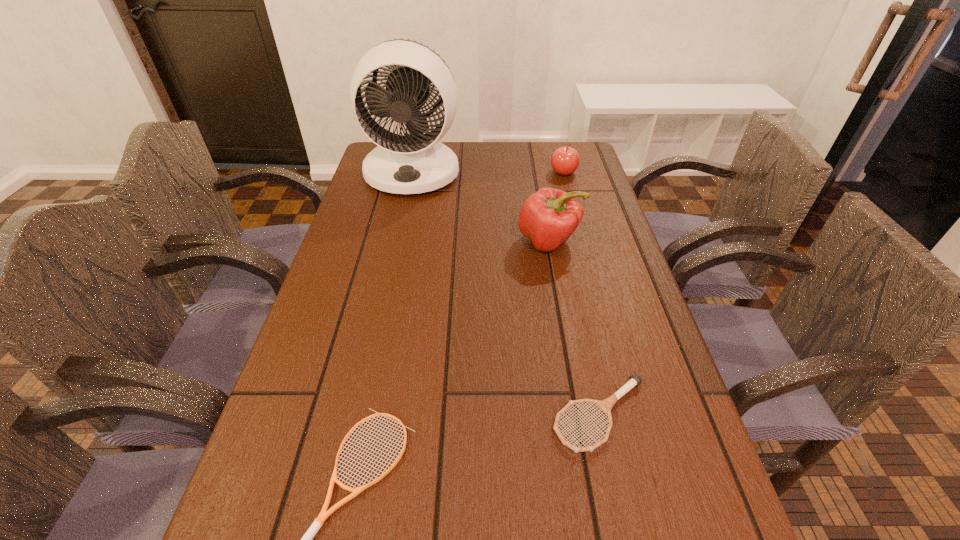
I want to click on fan, so click(414, 163).

In order to click on bell pepper in this screenshot , I will do `click(549, 217)`.

I want to click on the fourth shortest object, so click(549, 217).

Identify the location of the third shortest object. (565, 160).

Find the location of a particular element. This screenshot has width=960, height=540. the fourth tallest object is located at coordinates (605, 405).

The width and height of the screenshot is (960, 540). In order to click on the right tennis racket in this screenshot , I will do `click(605, 405)`.

Find the location of a particular element. This screenshot has width=960, height=540. free space located 0.370m on the grille of the fan is located at coordinates (388, 287).

This screenshot has height=540, width=960. I want to click on blank space located on the left of the third farthest object, so click(410, 241).

Identify the location of vacant point located 0.270m on the left of the third shortest object. (466, 172).

This screenshot has height=540, width=960. In order to click on blank area located 0.120m on the back of the right tennis racket in this screenshot , I will do `click(582, 330)`.